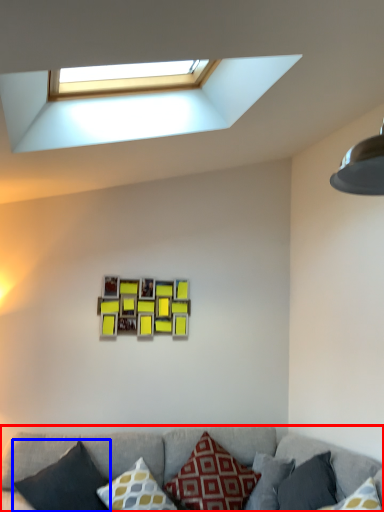
Question: Among these objects, which one is nearest to the camera, studio couch (highlighted by a red box) or pillow (highlighted by a blue box)?

Choices:
 (A) studio couch
 (B) pillow

Answer: (A)